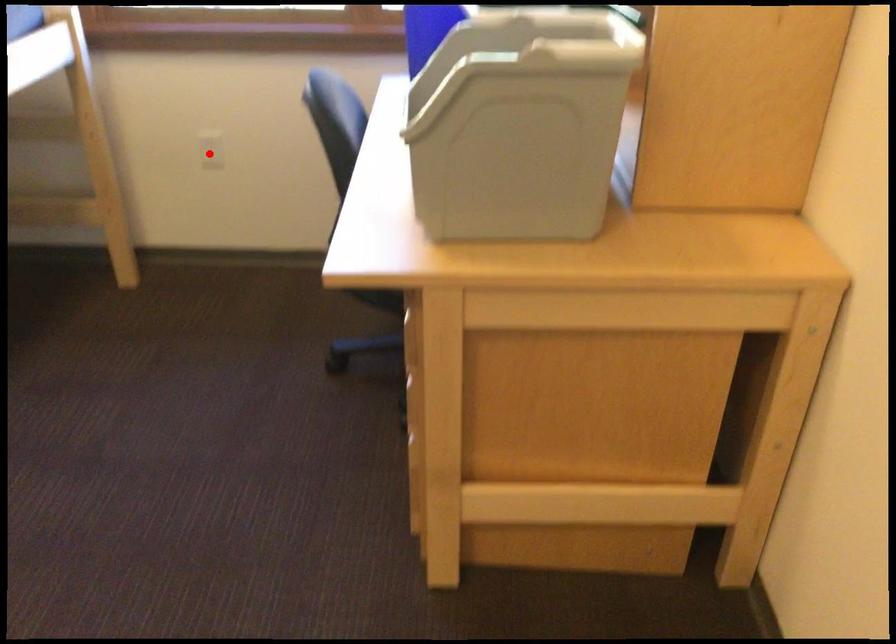
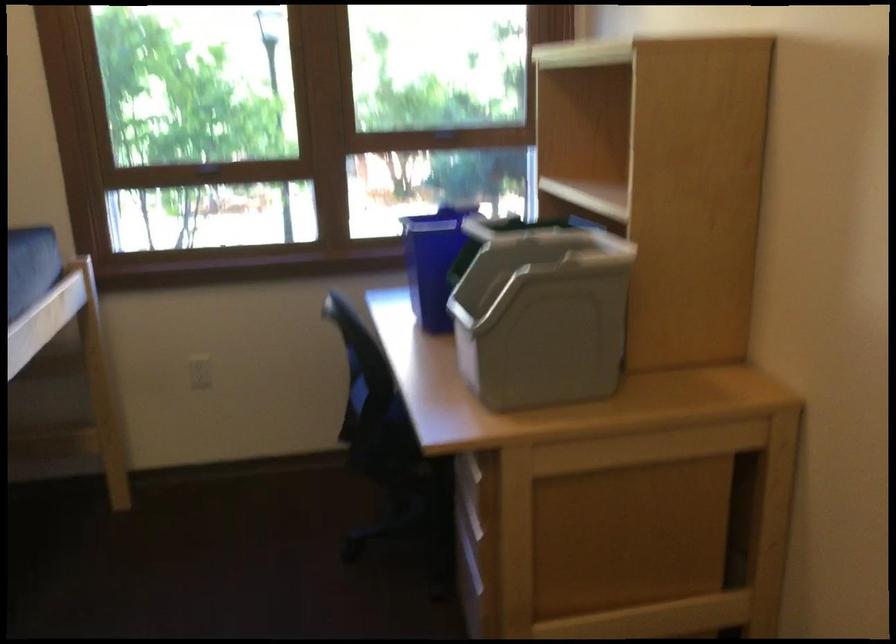
Locate, in the second image, the point that corresponds to the highlighted location in the first image.

(200, 372)